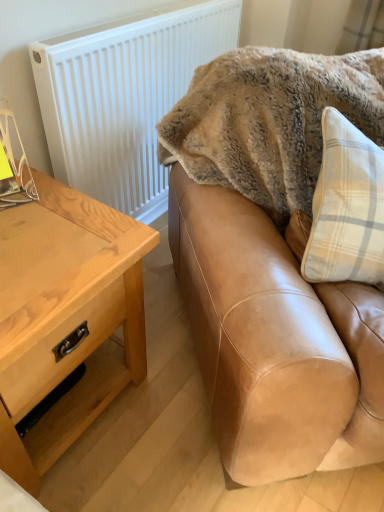
Question: From a real-world perspective, is tan leather couch at upper right positioned above or below fuzzy beige blanket at upper right?

Choices:
 (A) above
 (B) below

Answer: (B)

Question: Is tan leather couch at upper right in front of or behind fuzzy beige blanket at upper right in the image?

Choices:
 (A) behind
 (B) front

Answer: (B)

Question: Estimate the real-world distances between objects in this image. Which object is farther from the tan leather couch at upper right?

Choices:
 (A) white textured radiator at upper left
 (B) fuzzy beige blanket at upper right
 (C) light brown wood table at left

Answer: (A)

Question: Which object is the farthest from the tan leather couch at upper right?

Choices:
 (A) white textured radiator at upper left
 (B) light brown wood table at left
 (C) fuzzy beige blanket at upper right

Answer: (A)